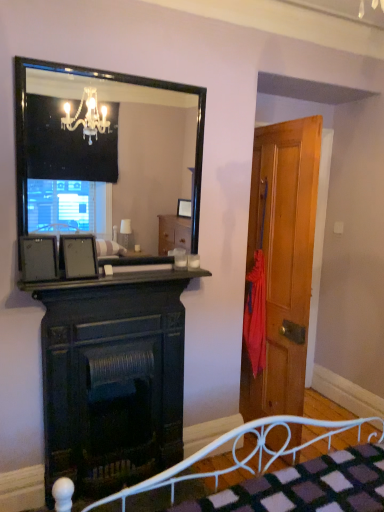
Question: Do you think wooden door at right is within dark wood fireplace at center, or outside of it?

Choices:
 (A) inside
 (B) outside

Answer: (B)

Question: In terms of size, does wooden door at right appear bigger or smaller than dark wood fireplace at center?

Choices:
 (A) small
 (B) big

Answer: (B)

Question: Which object is the closest to the wooden door at right?

Choices:
 (A) dark wood fireplace at center
 (B) black glossy mirror at upper center
 (C) matte black picture frame at left, arranged as the 2th picture frame when viewed from the right
 (D) white metal bed frame at lower center
 (E) dark wood mantle at center

Answer: (E)

Question: Based on their relative distances, which object is farther from the black glossy mirror at upper center?

Choices:
 (A) wooden door at right
 (B) dark wood mantle at center
 (C) matte black picture frame at center, which is the 2th picture frame in left-to-right order
 (D) matte black picture frame at left, arranged as the 2th picture frame when viewed from the right
 (E) dark wood fireplace at center

Answer: (C)